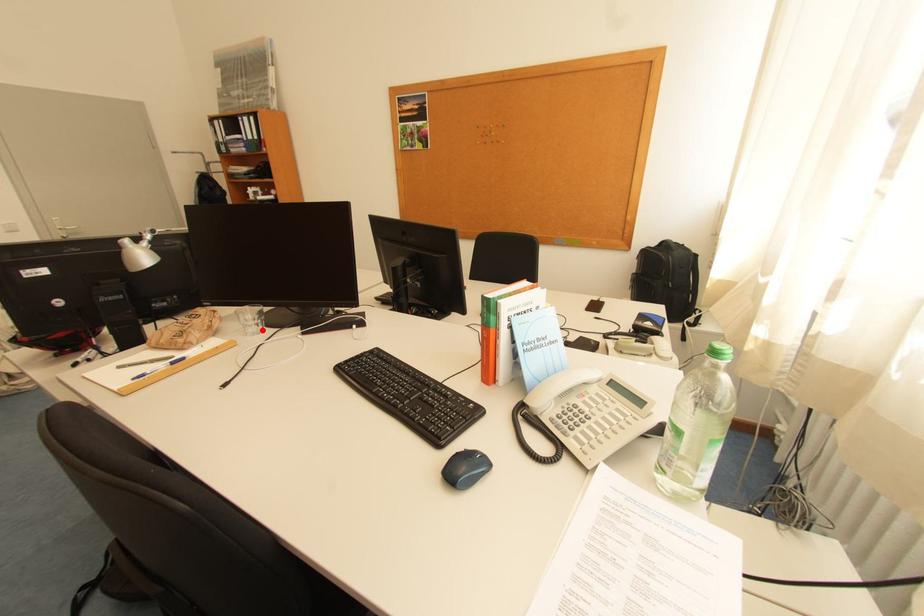
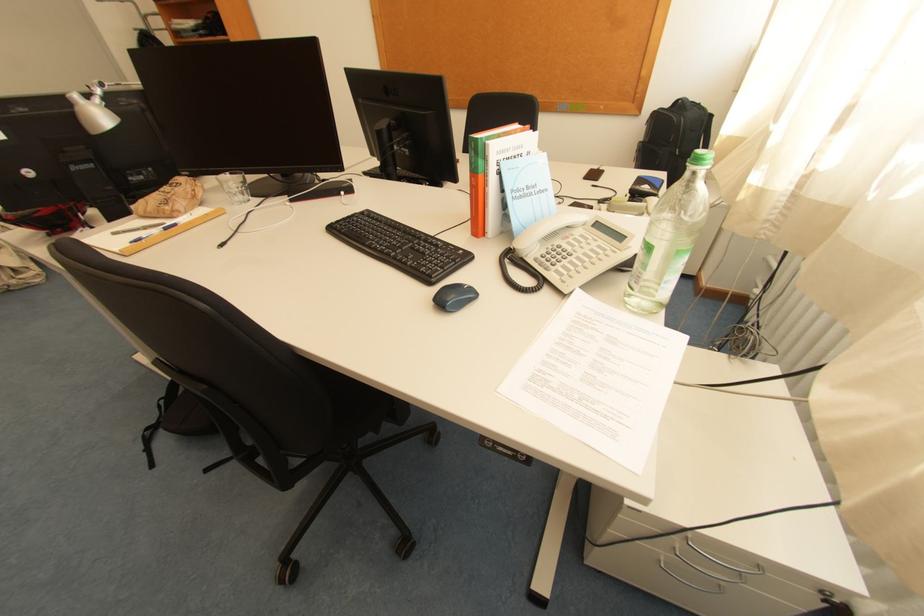
Find the pixel in the second image that matches the highlighted location in the first image.

(248, 198)